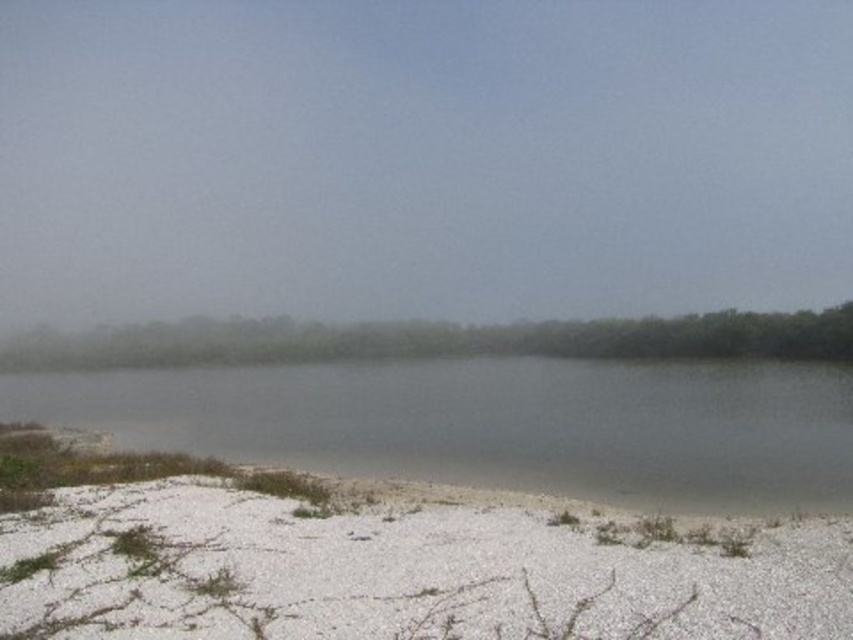
Question: Which point appears farthest from the camera in this image?

Choices:
 (A) (389, 465)
 (B) (424, 45)
 (C) (592, 636)

Answer: (B)

Question: Considering the real-world distances, which object is farthest from the foggy haze at upper center?

Choices:
 (A) gray matte lake at center
 (B) white gravelly sand at lower left

Answer: (B)

Question: Does white gravelly sand at lower left appear over gray matte lake at center?

Choices:
 (A) yes
 (B) no

Answer: (A)

Question: Can you confirm if white gravelly sand at lower left is positioned to the left of gray matte lake at center?

Choices:
 (A) no
 (B) yes

Answer: (A)

Question: Considering the real-world distances, which object is farthest from the foggy haze at upper center?

Choices:
 (A) white gravelly sand at lower left
 (B) gray matte lake at center

Answer: (A)

Question: Does foggy haze at upper center come in front of gray matte lake at center?

Choices:
 (A) no
 (B) yes

Answer: (A)